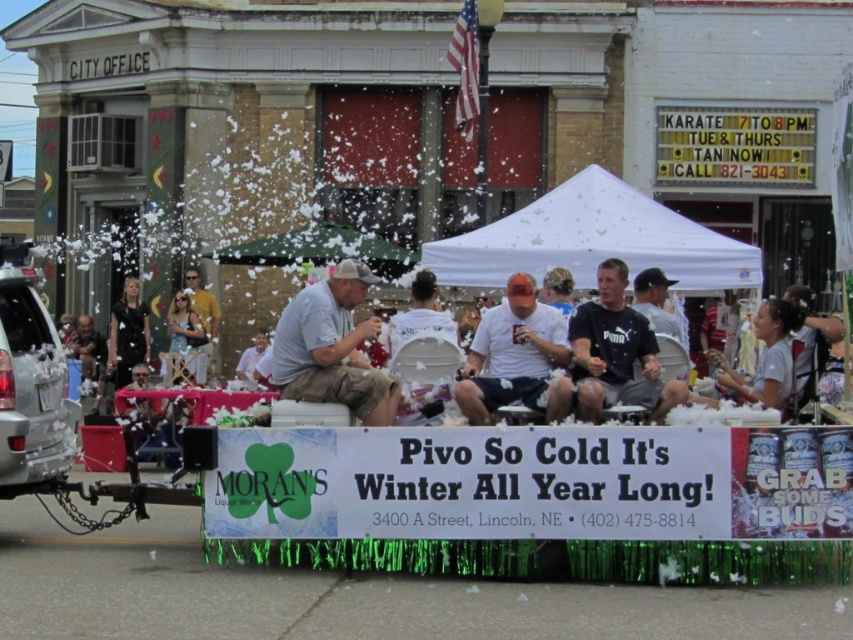
Between gray cotton shirt at center and black matte shirt at center, which one is positioned lower?

gray cotton shirt at center

Between gray cotton shirt at center and black matte shirt at center, which one is positioned higher?

black matte shirt at center is above.

Which is behind, point (320, 392) or point (622, 314)?

The point (622, 314) is more distant.

The image size is (853, 640). Find the location of `gray cotton shirt at center`. gray cotton shirt at center is located at coordinates (332, 348).

Is point (288, 384) behind point (671, 333)?

No, (288, 384) is closer to viewer.

Is gray cotton shirt at center above gray fabric cap at center?

Actually, gray cotton shirt at center is below gray fabric cap at center.

Is point (274, 348) more distant than point (676, 332)?

No, it is not.

Image resolution: width=853 pixels, height=640 pixels. Identify the location of gray cotton shirt at center. (332, 348).

Based on the photo, who is higher up, white fabric canopy at center or gray fabric cap at center?

white fabric canopy at center

Identify the location of white fabric canopy at center. (595, 241).